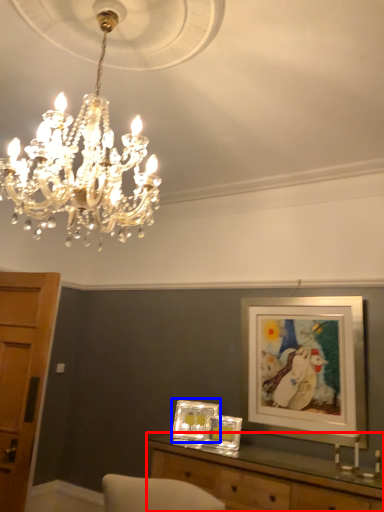
Question: Which object is further to the camera taking this photo, table (highlighted by a red box) or picture frame (highlighted by a blue box)?

Choices:
 (A) table
 (B) picture frame

Answer: (B)